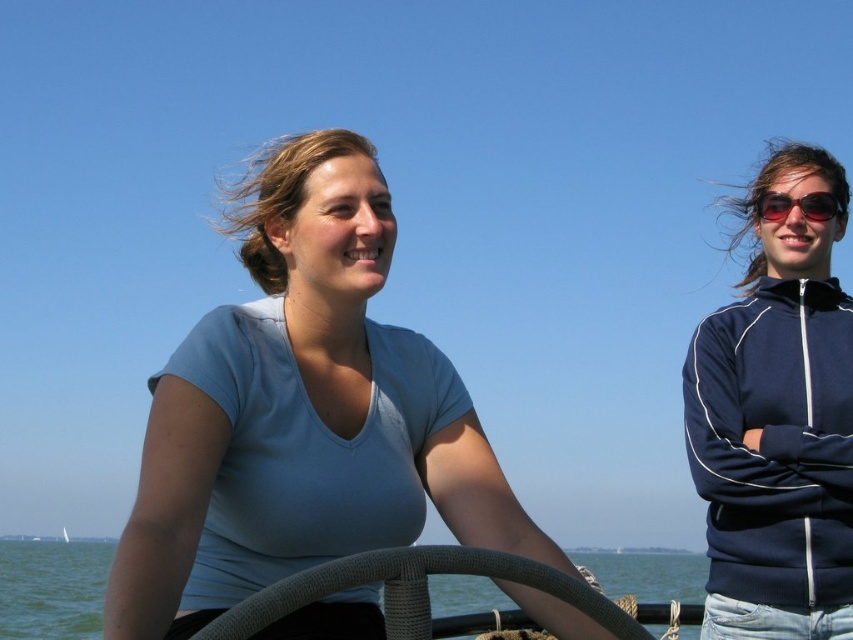
Can you confirm if textured grey steering wheel at center is shorter than white woven steering wheel at center?

Correct, textured grey steering wheel at center is not as tall as white woven steering wheel at center.

Who is more forward, (x=643, y=620) or (x=67, y=534)?

Point (x=643, y=620) is in front.

Who is more forward, (610, 632) or (64, 538)?

Point (610, 632) is in front.

The height and width of the screenshot is (640, 853). What are the coordinates of `textured grey steering wheel at center` in the screenshot? It's located at (421, 595).

Can you confirm if navy blue zip-up jacket at upper right is positioned to the left of white woven steering wheel at center?

In fact, navy blue zip-up jacket at upper right is to the right of white woven steering wheel at center.

Does navy blue zip-up jacket at upper right have a lesser width compared to white woven steering wheel at center?

No.

Identify the location of navy blue zip-up jacket at upper right. The height and width of the screenshot is (640, 853). (776, 422).

Is point (769, 214) positioned after point (67, 540)?

That is False.

Is sunglasses at right positioned at the back of white woven steering wheel at center?

That is False.

Where is `sunglasses at right`? The image size is (853, 640). sunglasses at right is located at coordinates 798,205.